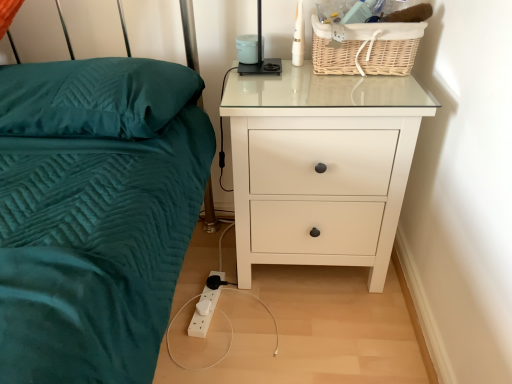
Question: Does point [x=413, y=28] appear closer or farther from the camera than point [x=410, y=125]?

Choices:
 (A) farther
 (B) closer

Answer: (A)

Question: In terms of size, does woven natural basket at upper right appear bigger or smaller than white glossy chest of drawers at right?

Choices:
 (A) small
 (B) big

Answer: (A)

Question: Considering the real-world distances, which object is closest to the teal quilted pillow at left?

Choices:
 (A) black plastic lamp at upper center
 (B) woven natural basket at upper right
 (C) white glossy chest of drawers at right

Answer: (C)

Question: Which object is positioned farthest from the woven natural basket at upper right?

Choices:
 (A) black plastic lamp at upper center
 (B) teal quilted pillow at left
 (C) white glossy chest of drawers at right

Answer: (B)